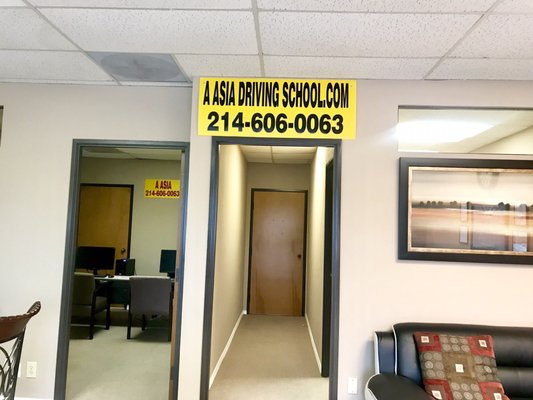
Find the location of a particular element. doors is located at coordinates (279, 245).